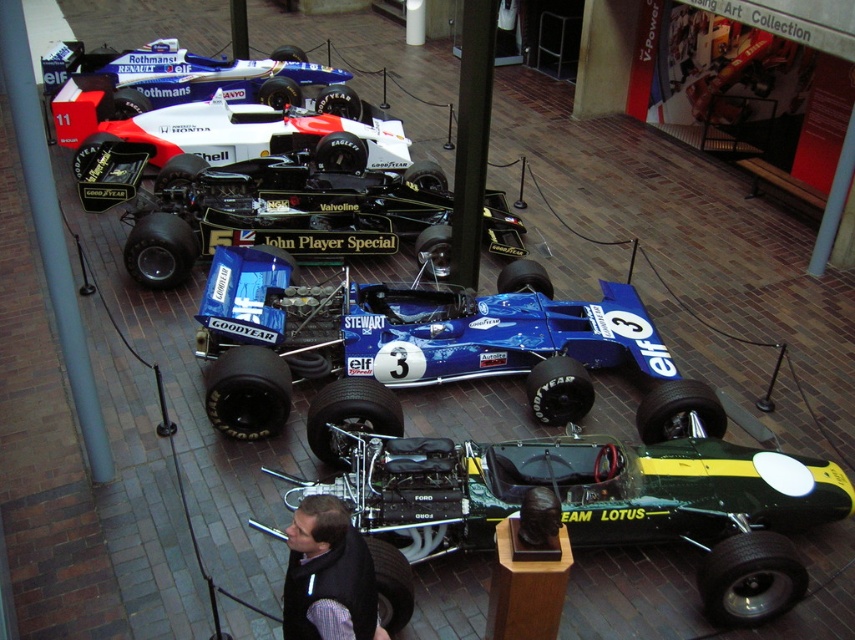
Question: Can you confirm if blue glossy race car at center is positioned to the left of black glossy race car at center?

Choices:
 (A) yes
 (B) no

Answer: (B)

Question: Can you confirm if black glossy race car at center is wider than dark gray vest at center?

Choices:
 (A) no
 (B) yes

Answer: (B)

Question: Which of these objects is positioned closest to the blue glossy race car at center?

Choices:
 (A) black glossy race car at center
 (B) green metallic race car at center
 (C) dark gray vest at center

Answer: (B)

Question: Which object is closer to the camera taking this photo?

Choices:
 (A) green metallic race car at center
 (B) dark gray vest at center
 (C) blue glossy race car at center

Answer: (B)

Question: Considering the real-world distances, which object is closest to the green metallic race car at center?

Choices:
 (A) blue glossy race car at center
 (B) black glossy race car at center
 (C) dark gray vest at center

Answer: (A)

Question: From the image, what is the correct spatial relationship of blue glossy race car at center in relation to black glossy race car at center?

Choices:
 (A) left
 (B) right

Answer: (B)